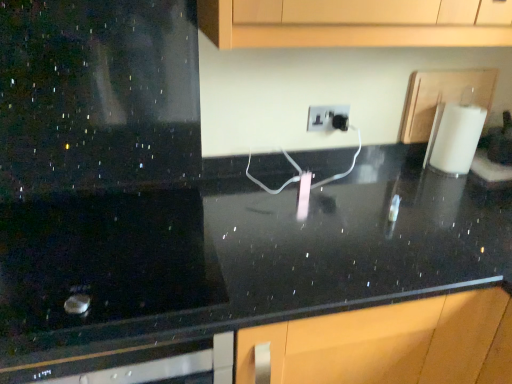
What is the approximate height of black polished countertop at center?

91.14 centimeters.

I want to click on white matte paper towel at right, so click(456, 138).

Who is smaller, black polished countertop at center or white plastic electric outlet at center?

Smaller between the two is white plastic electric outlet at center.

Are black polished countertop at center and white plastic electric outlet at center located far from each other?

That's not correct — black polished countertop at center is a little close to white plastic electric outlet at center.

Does black polished countertop at center lie behind white plastic electric outlet at center?

No, it is not.

Looking at this image, considering the sizes of objects black polished countertop at center and white matte paper towel at right in the image provided, who is bigger, black polished countertop at center or white matte paper towel at right?

black polished countertop at center.

Is black polished countertop at center in front of white matte paper towel at right?

Yes, black polished countertop at center is closer to the camera.

In the scene shown: Is black polished countertop at center turned away from white matte paper towel at right?

No, black polished countertop at center is not facing away from white matte paper towel at right.

Is black polished countertop at center wider or thinner than white matte paper towel at right?

black polished countertop at center is wider than white matte paper towel at right.

Between white matte paper towel at right and black polished countertop at center, which one has more height?

black polished countertop at center.

What's the angular difference between white matte paper towel at right and black polished countertop at center's facing directions?

They differ by 0.352 degrees in their facing directions.

Does point (440, 153) appear closer or farther from the camera than point (438, 280)?

Point (440, 153) appears to be farther away from the viewer than point (438, 280).

Looking at this image, from the image's perspective, is white matte paper towel at right positioned above or below black polished countertop at center?

Clearly, from the image's perspective, white matte paper towel at right is above black polished countertop at center.

Does white matte paper towel at right appear on the right side of white plastic electric outlet at center?

Correct, you'll find white matte paper towel at right to the right of white plastic electric outlet at center.

Can you confirm if white matte paper towel at right is smaller than white plastic electric outlet at center?

No, white matte paper towel at right is not smaller than white plastic electric outlet at center.

How distant is white matte paper towel at right from white plastic electric outlet at center?

white matte paper towel at right is 14.77 inches away from white plastic electric outlet at center.

From the image's perspective, who appears lower, white matte paper towel at right or white plastic electric outlet at center?

white matte paper towel at right is shown below in the image.

Could black polished countertop at center be considered to be inside white plastic electric outlet at center?

Actually, black polished countertop at center is outside white plastic electric outlet at center.

Between point (333, 128) and point (232, 196), which one is positioned behind?

Point (333, 128)

Between white plastic electric outlet at center and black polished countertop at center, which one has smaller size?

Smaller between the two is white plastic electric outlet at center.

Can you tell me how much white plastic electric outlet at center and black polished countertop at center differ in facing direction?

The facing directions of white plastic electric outlet at center and black polished countertop at center are 0.157 degrees apart.

Can you confirm if white plastic electric outlet at center is positioned to the left of white matte paper towel at right?

Yes.

Which object is closer to the camera taking this photo, white plastic electric outlet at center or white matte paper towel at right?

white matte paper towel at right is closer to the camera.

Does point (328, 119) appear closer or farther from the camera than point (481, 114)?

Point (328, 119) appears to be farther away from the viewer than point (481, 114).

Find the location of a particular element. Image resolution: width=512 pixels, height=384 pixels. countertop on the left of white plastic electric outlet at center is located at coordinates (234, 259).

You are a GUI agent. You are given a task and a screenshot of the screen. Output one action in this format:
    pyautogui.click(x=<x>, y=<y>)
    Task: Click on the paper towel that is behind the black polished countertop at center
    
    Given the screenshot: What is the action you would take?
    pyautogui.click(x=456, y=138)

When comparing their distances from white plastic electric outlet at center, does black polished countertop at center or white matte paper towel at right seem closer?

The object closer to white plastic electric outlet at center is white matte paper towel at right.

When comparing their distances from black polished countertop at center, does white plastic electric outlet at center or white matte paper towel at right seem closer?

white plastic electric outlet at center is positioned closer to the anchor black polished countertop at center.

Based on their spatial positions, is black polished countertop at center or white plastic electric outlet at center further from white matte paper towel at right?

black polished countertop at center lies further to white matte paper towel at right than the other object.

Looking at the image, which one is located closer to white plastic electric outlet at center, white matte paper towel at right or black polished countertop at center?

white matte paper towel at right.

Considering their positions, is white matte paper towel at right positioned closer to black polished countertop at center than white plastic electric outlet at center?

white plastic electric outlet at center.

Based on the photo, estimate the real-world distances between objects in this image. Which object is further from white matte paper towel at right, white plastic electric outlet at center or black polished countertop at center?

Among the two, black polished countertop at center is located further to white matte paper towel at right.

Where is `paper towel between black polished countertop at center and white plastic electric outlet at center along the z-axis`? The image size is (512, 384). paper towel between black polished countertop at center and white plastic electric outlet at center along the z-axis is located at coordinates (456, 138).